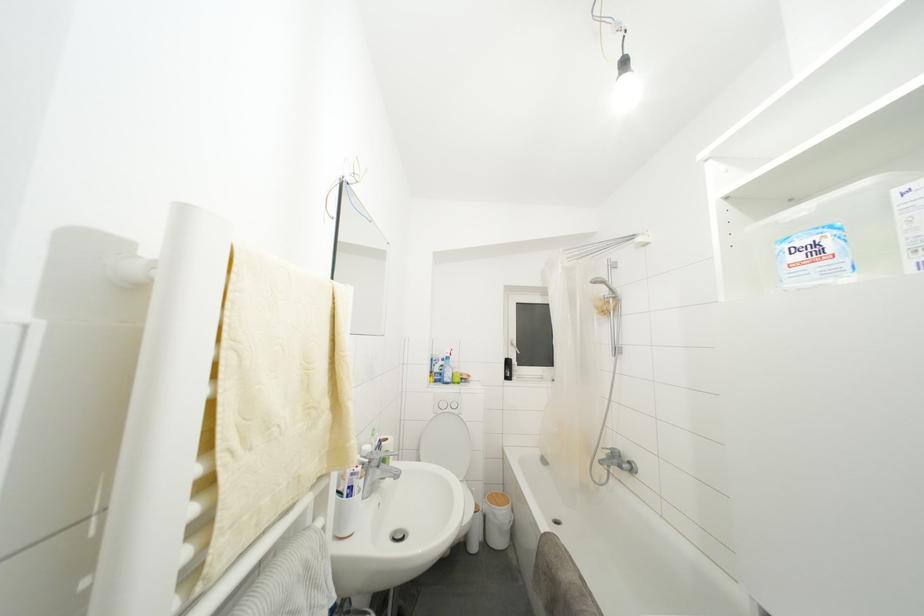
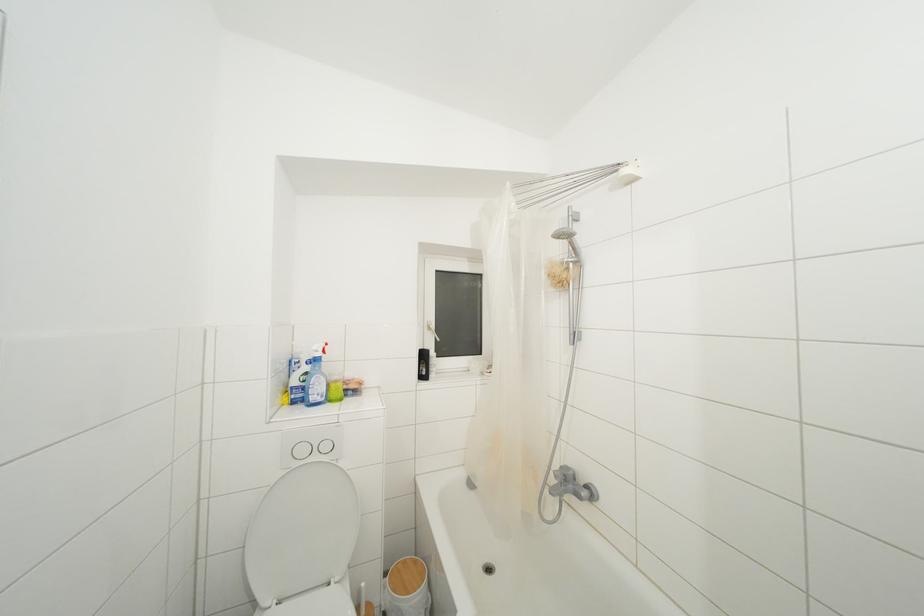
Where in the second image is the point corresponding to [447,410] from the first image?

(307, 456)